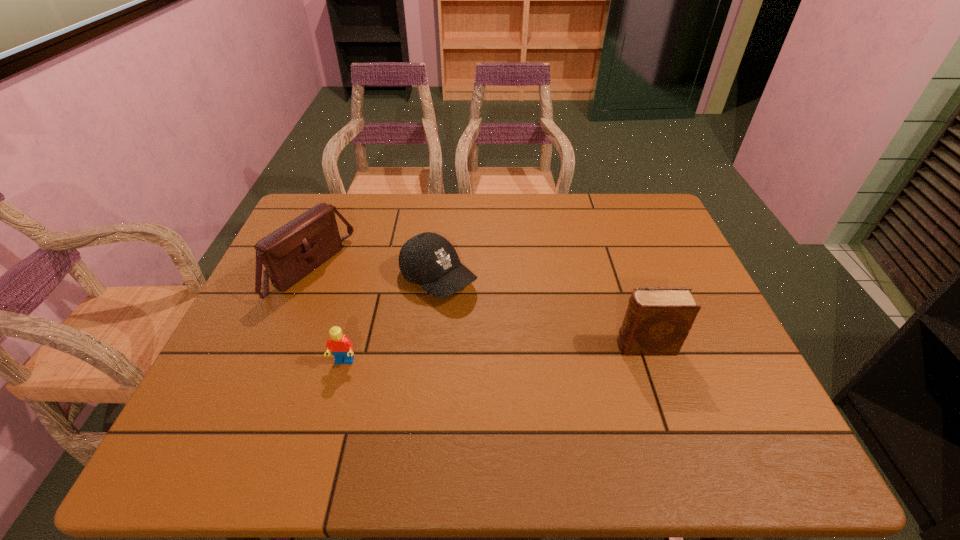
The height and width of the screenshot is (540, 960). I want to click on vacant space at the far right corner of the desktop, so click(646, 208).

This screenshot has height=540, width=960. In order to click on free space between the Lego and the leftmost object in this screenshot , I will do `click(326, 315)`.

Identify the location of blank region between the Lego and the baseball cap. The image size is (960, 540). (391, 320).

Image resolution: width=960 pixels, height=540 pixels. I want to click on blank region between the baseball cap and the diary, so click(x=541, y=312).

The height and width of the screenshot is (540, 960). I want to click on vacant point located between the second object from right to left and the rightmost object, so click(x=541, y=312).

Find the location of a particular element. This screenshot has height=540, width=960. unoccupied area between the rightmost object and the leftmost object is located at coordinates (477, 307).

Find the location of `vacant space that's between the diary and the shoulder bag`. vacant space that's between the diary and the shoulder bag is located at coordinates (477, 307).

The height and width of the screenshot is (540, 960). Find the location of `vacant space that's between the shoulder bag and the diary`. vacant space that's between the shoulder bag and the diary is located at coordinates (477, 307).

This screenshot has width=960, height=540. In order to click on free space that is in between the Lego and the diary in this screenshot , I will do click(x=494, y=354).

Where is `empty space between the shoulder bag and the diary`? The width and height of the screenshot is (960, 540). empty space between the shoulder bag and the diary is located at coordinates (477, 307).